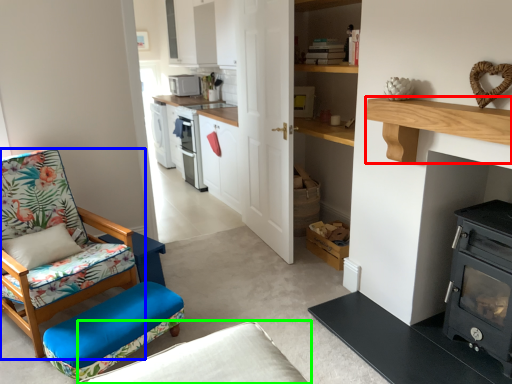
Question: Which object is positioned closest to shelf (highlighted by a red box)? Select from chair (highlighted by a blue box) and studio couch (highlighted by a green box).

Choices:
 (A) chair
 (B) studio couch

Answer: (B)